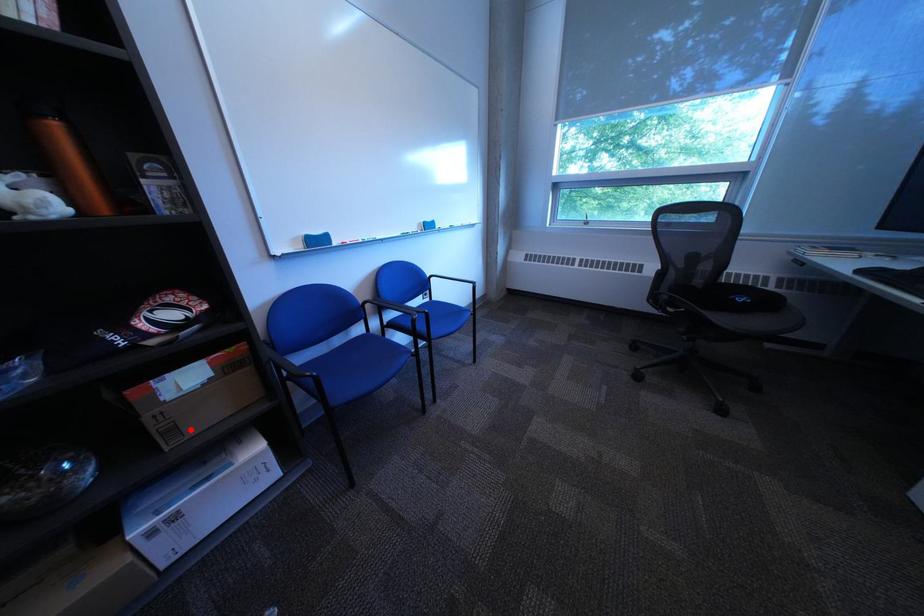
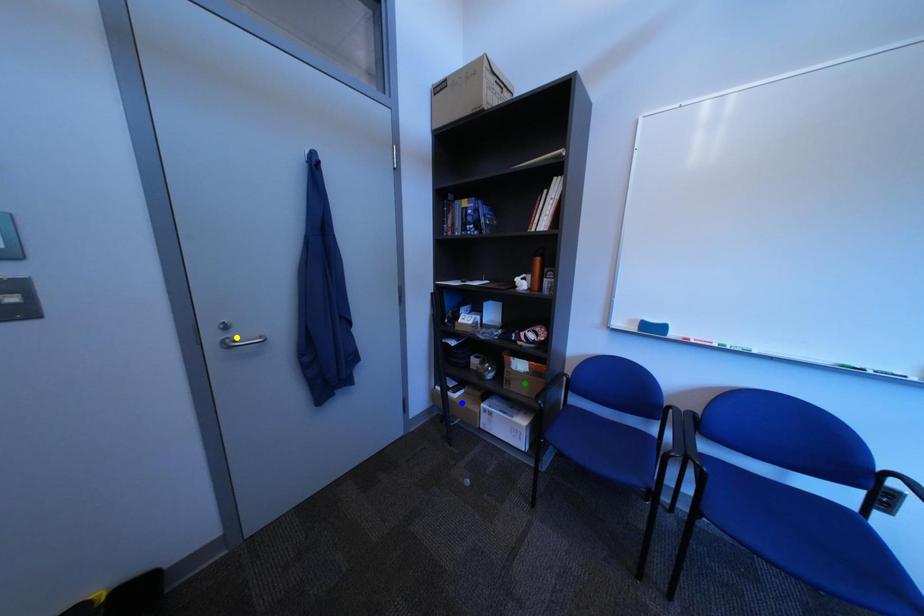
Question: I am providing you with two images of the same scene from different viewpoints. A red point is marked on the first image. You are given multiple points on the second image. Which point in image 2 is actually the same real-world point as the red point in image 1?

Choices:
 (A) yellow point
 (B) green point
 (C) blue point

Answer: (B)